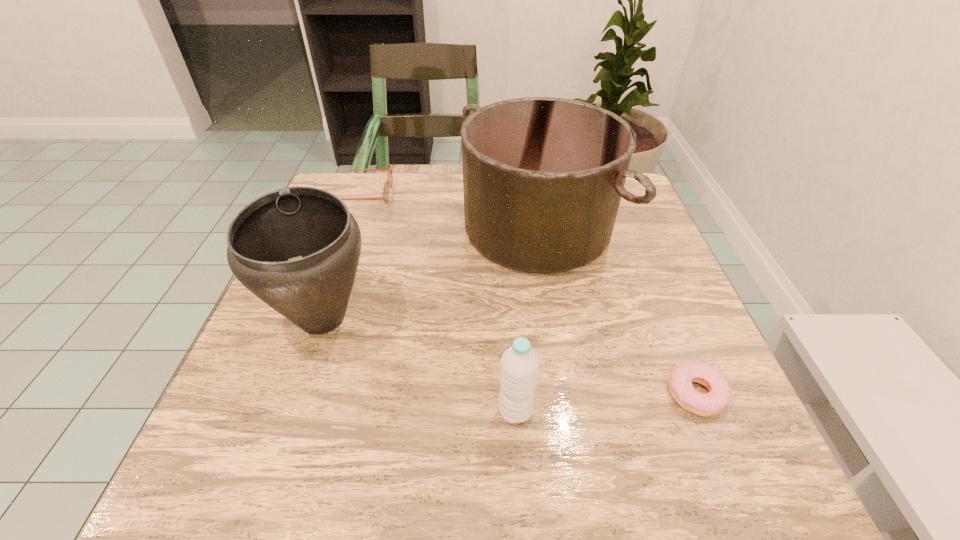
I want to click on pan, so click(x=543, y=177).

Identify the location of urn. This screenshot has height=540, width=960. (297, 248).

You are a GUI agent. You are given a task and a screenshot of the screen. Output one action in this format:
    pyautogui.click(x=<x>, y=<y>)
    Task: Click on the third shortest object
    This screenshot has height=540, width=960.
    Given the screenshot: What is the action you would take?
    pyautogui.click(x=519, y=364)

Locate an element on the screen. The height and width of the screenshot is (540, 960). sunglasses is located at coordinates (385, 196).

At what (x,y) coordinates should I click in order to perform the action: click on doughnut. Please return your answer as a coordinate pair (x, y). Image resolution: width=960 pixels, height=540 pixels. Looking at the image, I should click on (680, 381).

Where is `free location located 0.160m on the front of the pan`? Image resolution: width=960 pixels, height=540 pixels. free location located 0.160m on the front of the pan is located at coordinates (555, 342).

This screenshot has width=960, height=540. I want to click on vacant space located 0.110m on the back of the urn, so click(x=348, y=247).

Locate an element on the screen. vacant space situated 0.080m on the left of the water bottle is located at coordinates (448, 411).

The width and height of the screenshot is (960, 540). Find the location of `blank space located 0.130m on the front-facing side of the sunglasses`. blank space located 0.130m on the front-facing side of the sunglasses is located at coordinates (440, 194).

Where is `blank area located on the back of the doughnut`? The image size is (960, 540). blank area located on the back of the doughnut is located at coordinates point(640,258).